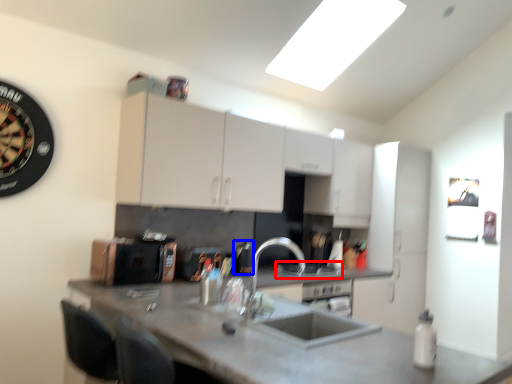
Question: Among these objects, which one is farthest to the camera, gas stove (highlighted by a red box) or appliance (highlighted by a blue box)?

Choices:
 (A) gas stove
 (B) appliance

Answer: (A)